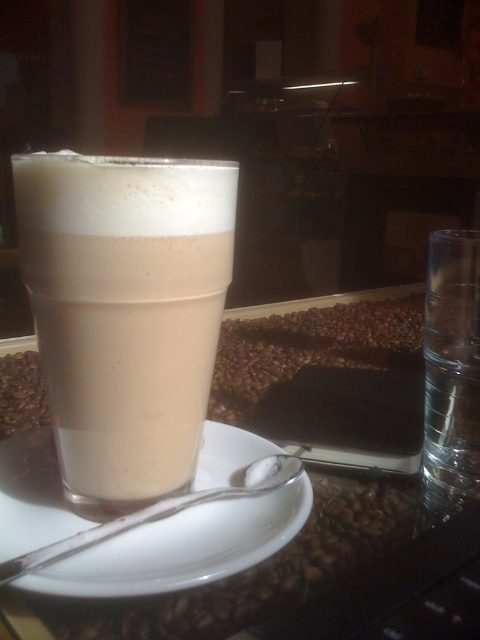
Question: Which object appears closest to the camera in this image?

Choices:
 (A) dark chocolate bar at center
 (B) smooth beige foam at center

Answer: (B)

Question: Which point is closer to the camera?

Choices:
 (A) (252, 497)
 (B) (273, 342)

Answer: (A)

Question: Observing the image, what is the correct spatial positioning of smooth beige foam at center in reference to dark chocolate bar at center?

Choices:
 (A) left
 (B) right

Answer: (A)

Question: Among these points, which one is nearest to the camera?

Choices:
 (A) (226, 497)
 (B) (291, 342)
 (C) (196, 216)

Answer: (C)

Question: Can you confirm if dark chocolate bar at center is thinner than silver metallic spoon at lower center?

Choices:
 (A) yes
 (B) no

Answer: (B)

Question: Can you confirm if smooth beige foam at center is positioned above silver metallic spoon at lower center?

Choices:
 (A) yes
 (B) no

Answer: (A)